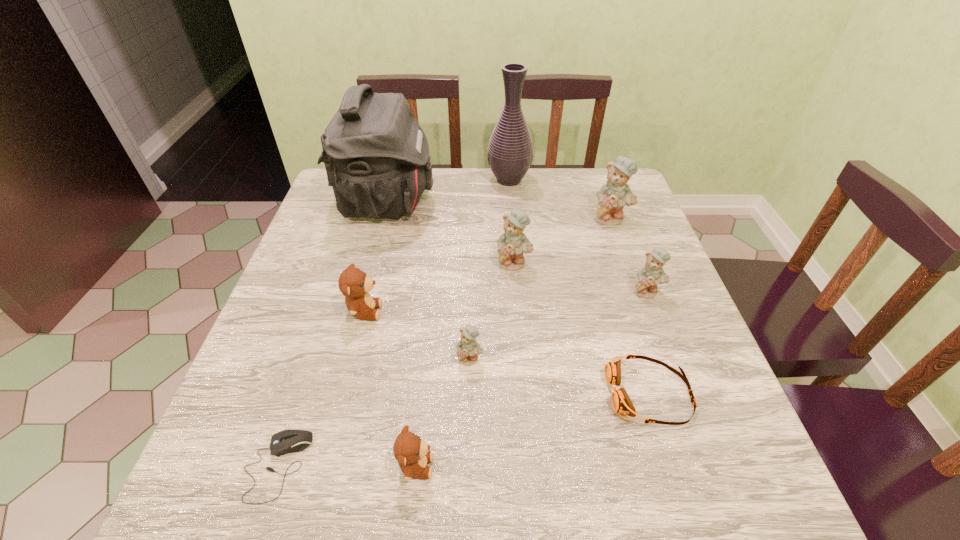
Image resolution: width=960 pixels, height=540 pixels. I want to click on vacant region between the third farthest blue teddy bear and the seventh shortest object, so click(580, 277).

What are the coordinates of `vacant area that lies between the nearest blue teddy bear and the second nearest blue teddy bear` in the screenshot? It's located at (559, 325).

Locate an element on the screen. This screenshot has height=540, width=960. vacant space in between the fourth teddy bear from right to left and the second blue teddy bear from left to right is located at coordinates (492, 310).

Identify which object is located as the nearest to the second nearest blue teddy bear. Please provide its 2D coordinates. Your answer should be formatted as a tuple, i.e. [(x, y)], where the tuple contains the x and y coordinates of a point satisfying the conditions above.

[(621, 403)]

At what (x,y) coordinates should I click in order to perform the action: click on object that stands as the closest to the smaller brown teddy bear. Please return your answer as a coordinate pair (x, y). Looking at the image, I should click on (287, 441).

Locate which teddy bear ranks second in proximity to the shoulder bag. Please provide its 2D coordinates. Your answer should be formatted as a tuple, i.e. [(x, y)], where the tuple contains the x and y coordinates of a point satisfying the conditions above.

[(354, 284)]

Where is `the closest teddy bear to the third biggest blue teddy bear`? the closest teddy bear to the third biggest blue teddy bear is located at coordinates (612, 197).

Identify which blue teddy bear is the fourth closest to the bigger brown teddy bear. Please provide its 2D coordinates. Your answer should be formatted as a tuple, i.e. [(x, y)], where the tuple contains the x and y coordinates of a point satisfying the conditions above.

[(612, 197)]

You are a GUI agent. You are given a task and a screenshot of the screen. Output one action in this format:
    pyautogui.click(x=<x>, y=<y>)
    Task: Click on the second closest blue teddy bear to the computer mouse
    The height and width of the screenshot is (540, 960).
    Given the screenshot: What is the action you would take?
    pyautogui.click(x=512, y=243)

Locate an element on the screen. This screenshot has height=540, width=960. vacant area that satisfies the following two spatial constraints: 1. on the front-facing side of the third farthest blue teddy bear; 2. on the face of the nearest teddy bear is located at coordinates (713, 466).